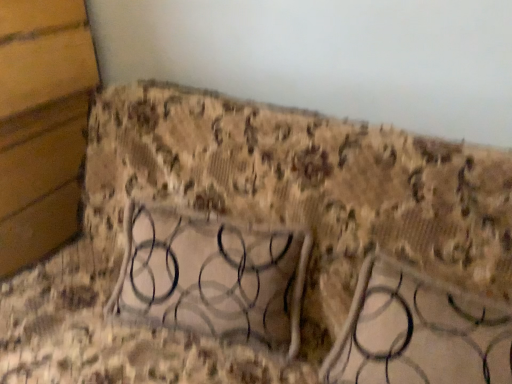
Question: From a real-world perspective, is metallic silver table at center positioned above or below metallic textured frame at lower left?

Choices:
 (A) above
 (B) below

Answer: (B)

Question: Is metallic silver table at center bigger or smaller than metallic textured frame at lower left?

Choices:
 (A) big
 (B) small

Answer: (B)

Question: Do you think metallic silver table at center is within metallic textured frame at lower left, or outside of it?

Choices:
 (A) inside
 (B) outside

Answer: (B)

Question: From a real-world perspective, is metallic textured frame at lower left positioned above or below metallic silver table at center?

Choices:
 (A) below
 (B) above

Answer: (B)

Question: Would you say metallic textured frame at lower left is to the left or to the right of metallic silver table at center in the picture?

Choices:
 (A) right
 (B) left

Answer: (B)

Question: Does point (86, 61) appear closer or farther from the camera than point (434, 329)?

Choices:
 (A) farther
 (B) closer

Answer: (A)

Question: In terms of width, does metallic textured frame at lower left look wider or thinner when compared to metallic silver table at center?

Choices:
 (A) wide
 (B) thin

Answer: (A)